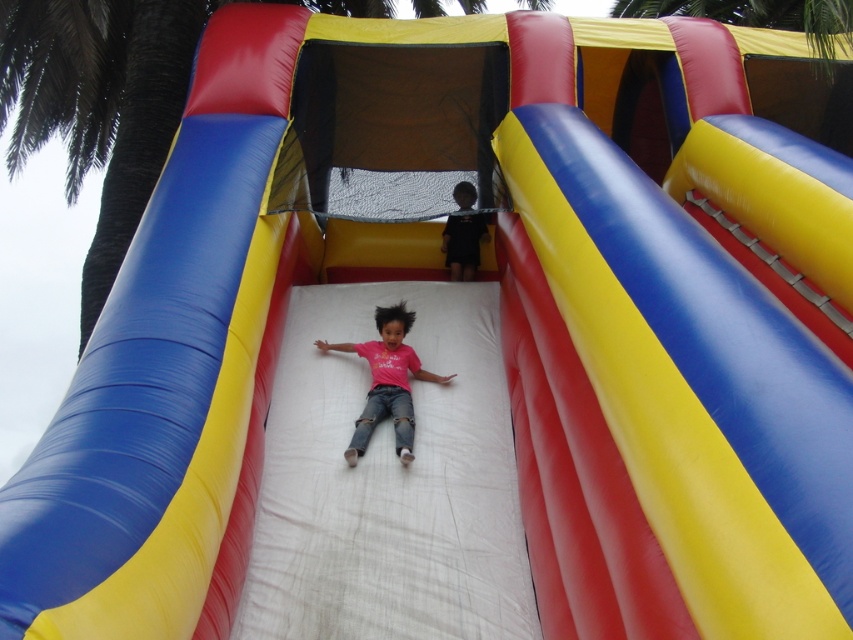
You are a parent supervising children at the park. You notice the pink matte shirt at center and the dark blue fabric boy at upper center. Which child is closer to the bottom of the slide?

The pink matte shirt at center is closer to the bottom of the slide because it has a lesser height compared to the dark blue fabric boy at upper center.

You are a photographer trying to capture both the pink matte shirt at center and the dark blue fabric boy at upper center in a single photo. Which of the two objects should you focus on first to ensure they are both in clear view?

The pink matte shirt at center is larger in size than the dark blue fabric boy at upper center, so you should focus on the pink matte shirt at center first to ensure both are in clear view.